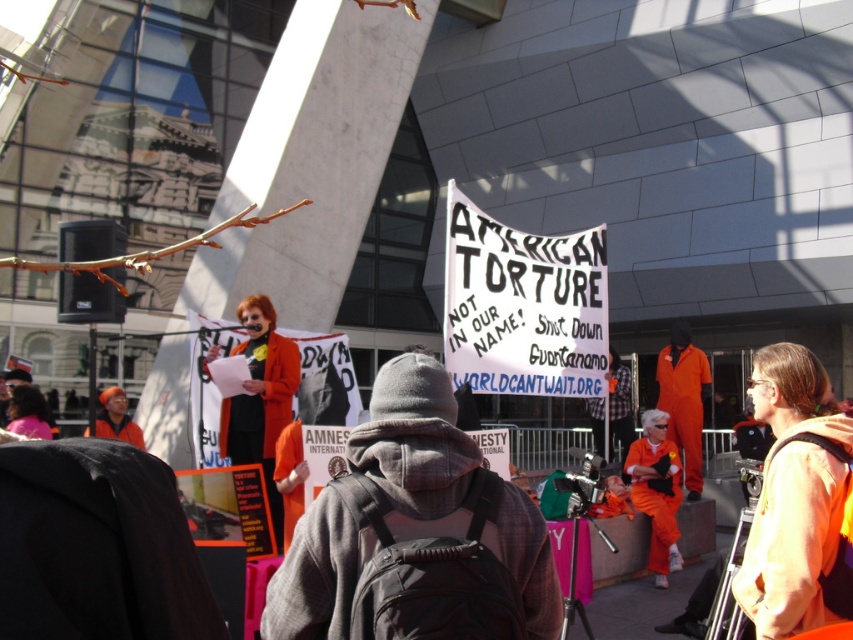
Between orange jumpsuit at center and orange fabric at lower right, which one appears on the right side from the viewer's perspective?

Positioned to the right is orange fabric at lower right.

Who is taller, orange jumpsuit at center or orange fabric at lower right?

orange fabric at lower right is taller.

Between point (428, 534) and point (672, 486), which one is positioned behind?

The point (672, 486) is behind.

I want to click on orange jumpsuit at center, so click(416, 449).